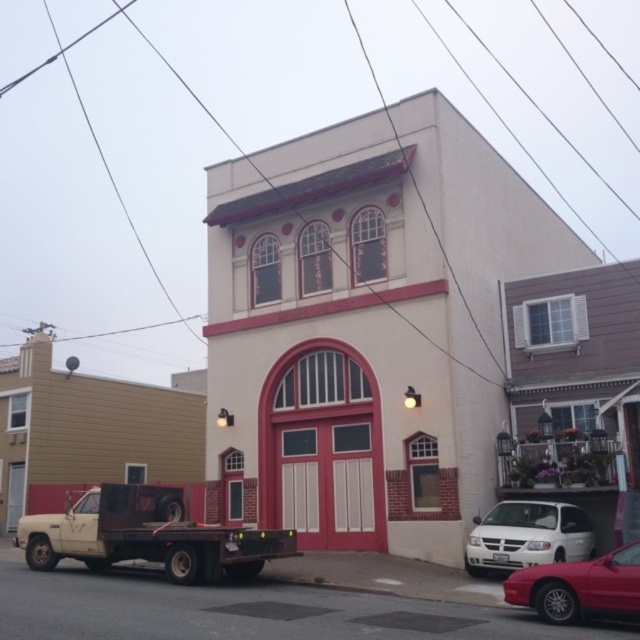
You are a delivery person trying to park your beige matte flatbed truck at lower left near the entrance of the two story building. There is a white matte van at lower right already parked there. Can you park your truck without moving the van?

The beige matte flatbed truck at lower left is located below the white matte van at lower right, which suggests that there is enough space between them for the truck to park without moving the van.

You are a delivery driver approaching the building and need to park your beige matte flatbed truck at lower left near the shiny red sedan at lower right. Can you park the truck to the left of the sedan without crossing the sidewalk?

The beige matte flatbed truck at lower left is already positioned to the left of the shiny red sedan at lower right, so you can park it there without crossing the sidewalk.